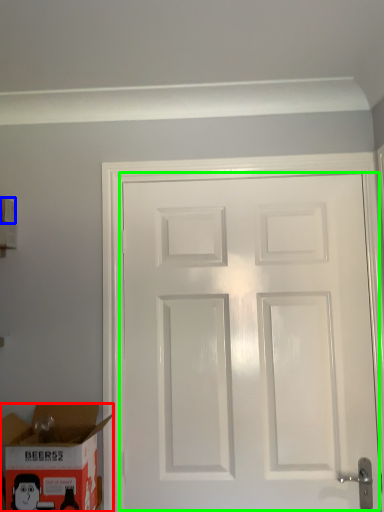
Question: Based on their relative distances, which object is nearer to box (highlighted by a red box)? Choose from box (highlighted by a blue box) and door (highlighted by a green box).

Choices:
 (A) box
 (B) door

Answer: (B)